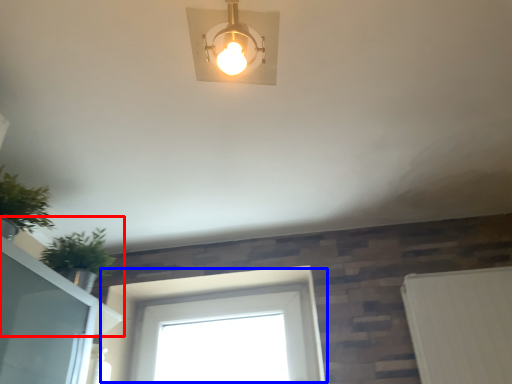
Question: Which of the following is the closest to the observer, window sill (highlighted by a red box) or window (highlighted by a blue box)?

Choices:
 (A) window sill
 (B) window

Answer: (A)